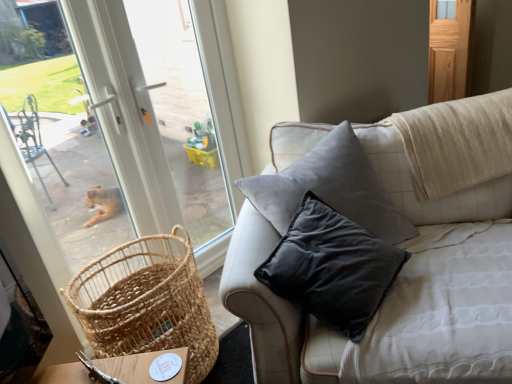
Question: Is woven natural basket at lower left a part of velvet grey pillow at upper right?

Choices:
 (A) yes
 (B) no

Answer: (B)

Question: Is woven natural basket at lower left at the back of velvet grey pillow at upper right?

Choices:
 (A) yes
 (B) no

Answer: (B)

Question: Considering the relative sizes of velvet grey pillow at upper right and woven natural basket at lower left in the image provided, is velvet grey pillow at upper right shorter than woven natural basket at lower left?

Choices:
 (A) no
 (B) yes

Answer: (A)

Question: Is velvet grey pillow at upper right taller than woven natural basket at lower left?

Choices:
 (A) no
 (B) yes

Answer: (B)

Question: Could you tell me if velvet grey pillow at upper right is turned towards woven natural basket at lower left?

Choices:
 (A) yes
 (B) no

Answer: (B)

Question: In terms of height, does wooden screen door at upper right look taller or shorter compared to woven natural basket at lower left?

Choices:
 (A) tall
 (B) short

Answer: (A)

Question: Considering their positions, is wooden screen door at upper right located in front of or behind woven natural basket at lower left?

Choices:
 (A) front
 (B) behind

Answer: (B)

Question: From a real-world perspective, is wooden screen door at upper right above or below woven natural basket at lower left?

Choices:
 (A) below
 (B) above

Answer: (B)

Question: In terms of width, does wooden screen door at upper right look wider or thinner when compared to woven natural basket at lower left?

Choices:
 (A) wide
 (B) thin

Answer: (B)

Question: Relative to velvet grey pillow at upper right, is wooden screen door at upper right in front or behind?

Choices:
 (A) front
 (B) behind

Answer: (B)

Question: From the image's perspective, is wooden screen door at upper right positioned above or below velvet grey pillow at upper right?

Choices:
 (A) above
 (B) below

Answer: (A)

Question: Would you say wooden screen door at upper right is inside or outside velvet grey pillow at upper right?

Choices:
 (A) inside
 (B) outside

Answer: (B)

Question: Considering the positions of wooden screen door at upper right and velvet grey pillow at upper right in the image, is wooden screen door at upper right wider or thinner than velvet grey pillow at upper right?

Choices:
 (A) wide
 (B) thin

Answer: (B)

Question: Considering the positions of velvet grey pillow at upper right and wooden screen door at upper right in the image, is velvet grey pillow at upper right bigger or smaller than wooden screen door at upper right?

Choices:
 (A) big
 (B) small

Answer: (A)

Question: Based on their positions, is velvet grey pillow at upper right located to the left or right of wooden screen door at upper right?

Choices:
 (A) right
 (B) left

Answer: (B)